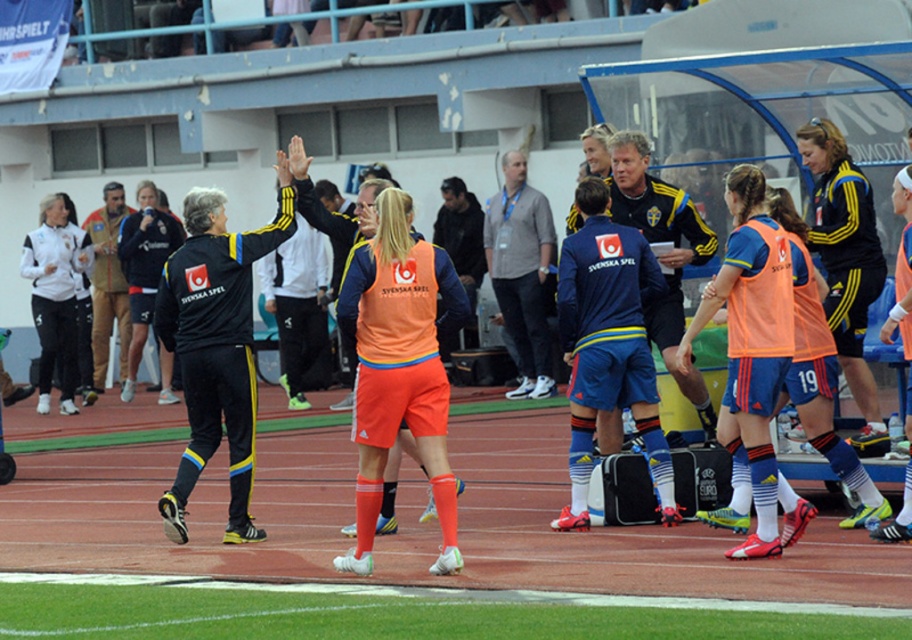
Question: Among these points, which one is nearest to the camera?

Choices:
 (A) (270, 513)
 (B) (680, 205)

Answer: (B)

Question: Which point is closer to the camera?

Choices:
 (A) matte blue shorts at center
 (B) brown leather jacket at left

Answer: (A)

Question: Which is nearer to the matte blue shorts at center?

Choices:
 (A) brown leather jacket at left
 (B) green turf at lower center

Answer: (B)

Question: Does matte blue shorts at center have a greater width compared to brown leather jacket at left?

Choices:
 (A) no
 (B) yes

Answer: (B)

Question: Can you confirm if green turf at lower center is positioned below matte blue shorts at center?

Choices:
 (A) no
 (B) yes

Answer: (B)

Question: Can you confirm if green turf at lower center is thinner than brown leather jacket at left?

Choices:
 (A) yes
 (B) no

Answer: (B)